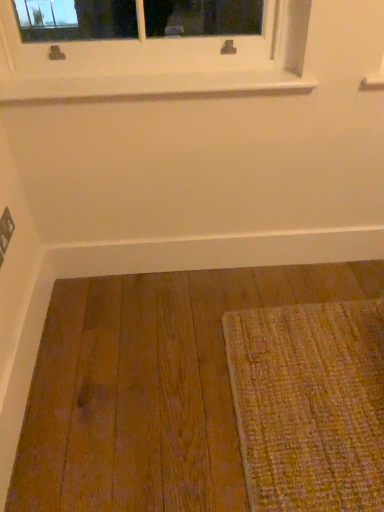
Question: Considering the positions of white smooth baseboard at lower center and white smooth window sill at upper center in the image, is white smooth baseboard at lower center wider or thinner than white smooth window sill at upper center?

Choices:
 (A) thin
 (B) wide

Answer: (A)

Question: Would you say white smooth baseboard at lower center is to the left or to the right of white smooth window sill at upper center in the picture?

Choices:
 (A) right
 (B) left

Answer: (A)

Question: Is white smooth baseboard at lower center spatially inside white smooth window sill at upper center, or outside of it?

Choices:
 (A) outside
 (B) inside

Answer: (A)

Question: Is point (198, 74) positioned closer to the camera than point (66, 269)?

Choices:
 (A) farther
 (B) closer

Answer: (B)

Question: Is white smooth window sill at upper center wider or thinner than white smooth baseboard at lower center?

Choices:
 (A) wide
 (B) thin

Answer: (A)

Question: Considering the positions of white smooth window sill at upper center and white smooth baseboard at lower center in the image, is white smooth window sill at upper center taller or shorter than white smooth baseboard at lower center?

Choices:
 (A) tall
 (B) short

Answer: (B)

Question: Which is correct: white smooth window sill at upper center is inside white smooth baseboard at lower center, or outside of it?

Choices:
 (A) inside
 (B) outside

Answer: (B)